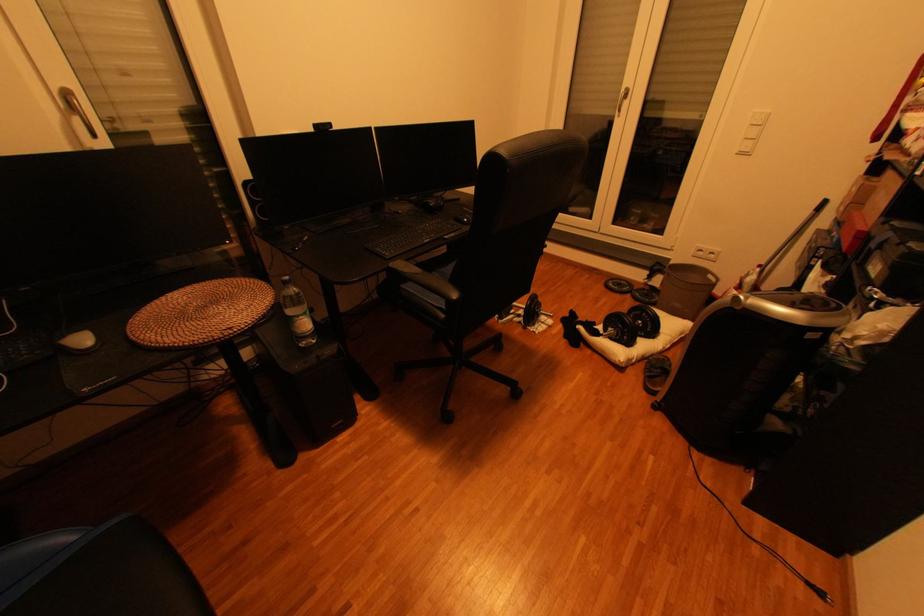
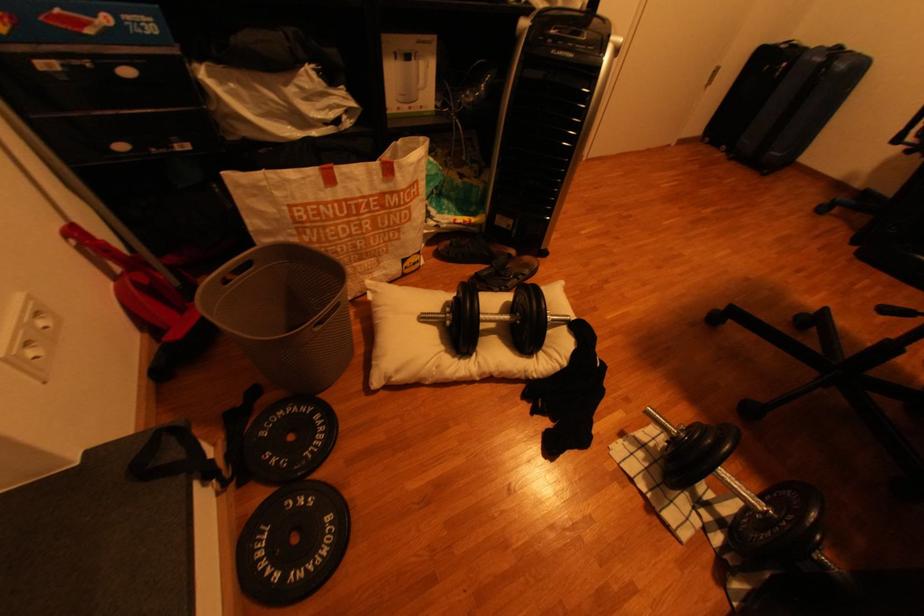
The point at (548, 323) is marked in the first image. Where is the corresponding point in the second image?

(665, 446)